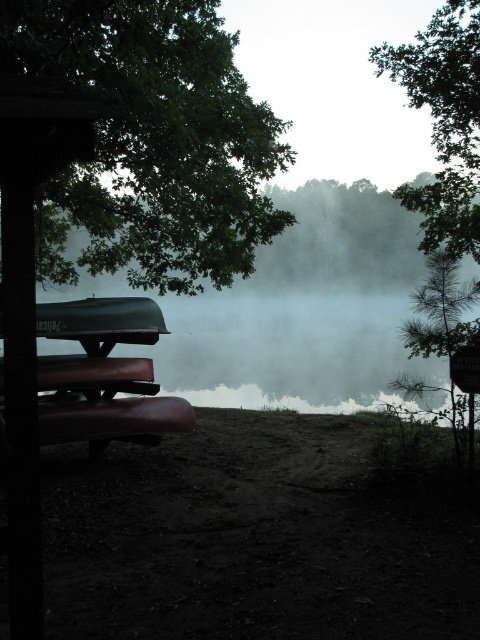
You are a hiker who wants to take a photo of both the green leafy tree at upper left and the green leafy tree at upper right in the same frame. Which tree should you move closer to if you want both trees to appear equally sized in your photo?

You should move closer to the green leafy tree at upper right because it is smaller than the green leafy tree at upper left. By moving closer to the smaller tree, you can balance their apparent sizes in the photo.